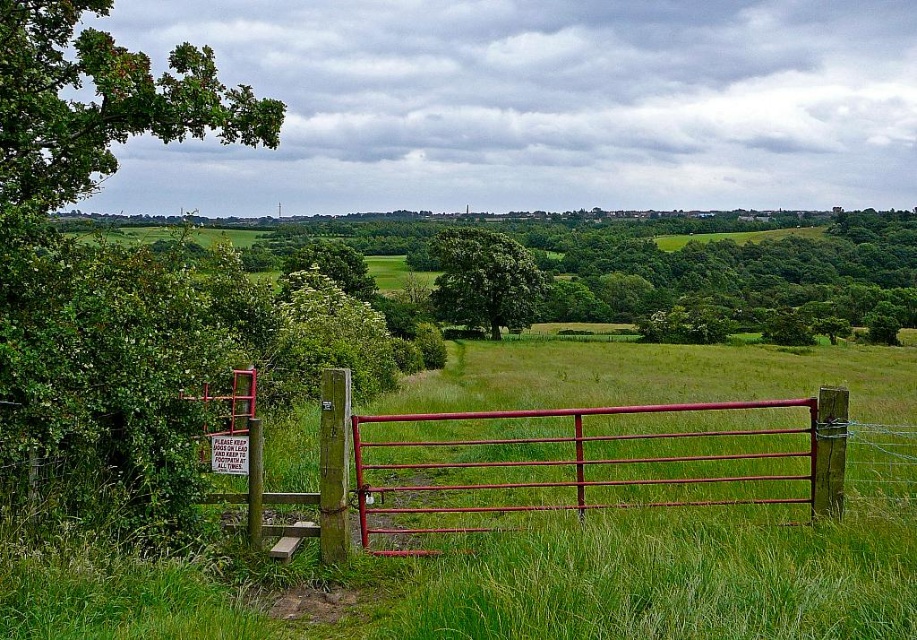
You are a painter standing at the edge of the field and want to paint the smooth metal gate at center and the green leafy tree at center. Which object should you focus on first if you want to paint the taller one first?

The green leafy tree at center is taller than the smooth metal gate at center, so you should focus on painting the green leafy tree at center first.

You are standing in front of the red metal gate with horizontal bars. There are two points marked in the image. Which point, point 1 at coordinates (727,486) or point 2 at coordinates (463,260), is closer to you?

Point 1 at coordinates (727,486) is closer to the viewer than point 2 at coordinates (463,260).